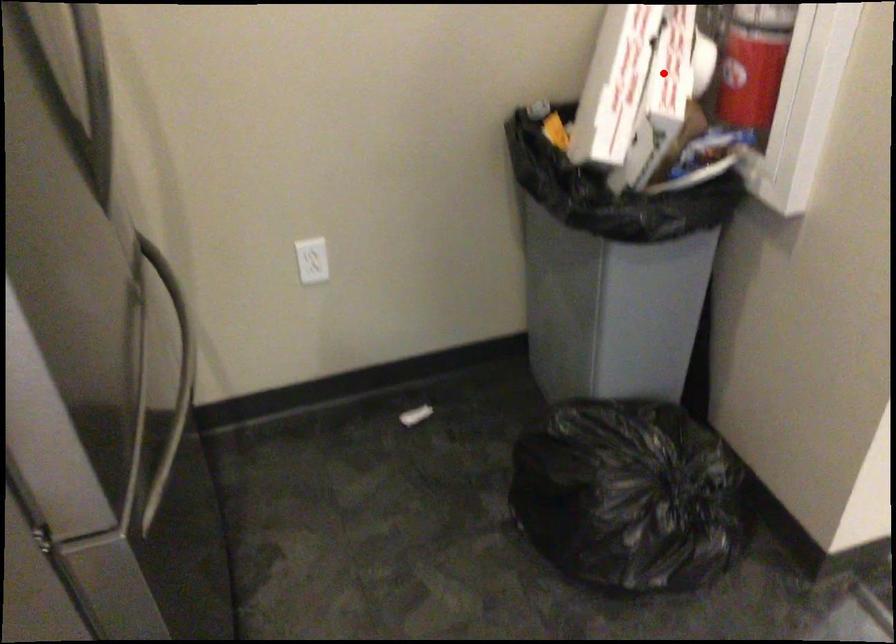
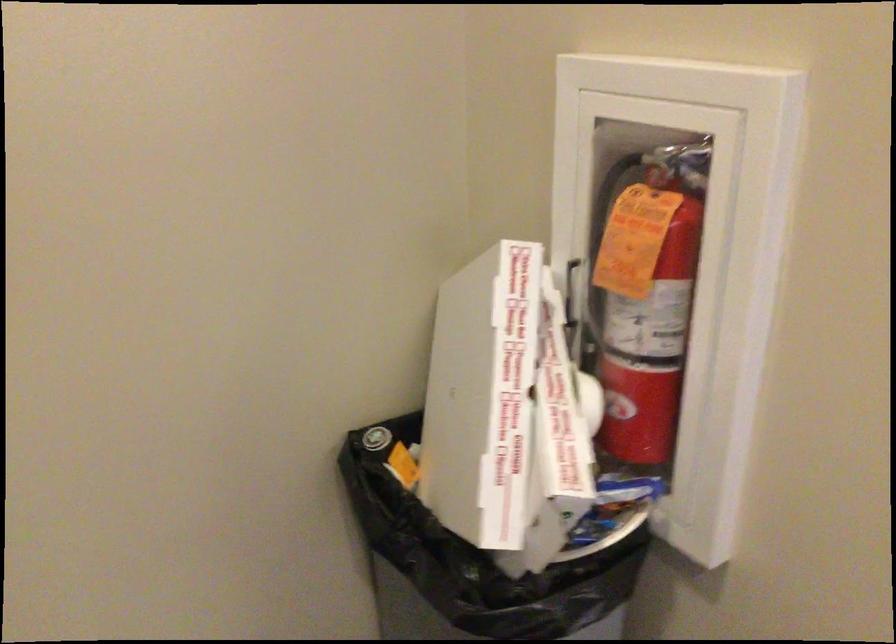
In the second image, find the point that corresponds to the highlighted location in the first image.

(556, 444)